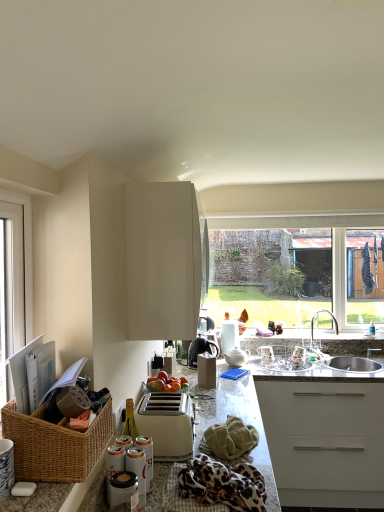
Measure the distance between green textured towel at lower center and camera.

A distance of 1.64 meters exists between green textured towel at lower center and camera.

Measure the distance between point (202, 350) and camera.

They are 9.43 feet apart.

Describe the element at coordinates (200, 350) in the screenshot. I see `matte black coffee maker at center, which is counted as the 2th appliance, starting from the front` at that location.

Measure the distance between point (232, 355) and camera.

Point (232, 355) and camera are 10.28 feet apart.

What is the approximate width of leopard print fabric at lower center?

14.46 inches.

I want to click on woven brown basket at lower left, so click(x=54, y=445).

Is glossy white cabinet at upper center in front of or behind satin nickel faucet at sink right in the image?

Visually, glossy white cabinet at upper center is located in front of satin nickel faucet at sink right.

From a real-world perspective, is glossy white cabinet at upper center on satin nickel faucet at sink right?

Yes, from a real-world perspective, glossy white cabinet at upper center is over satin nickel faucet at sink right

How different are the orientations of glossy white cabinet at upper center and satin nickel faucet at sink right in degrees?

90 degrees separate the facing orientations of glossy white cabinet at upper center and satin nickel faucet at sink right.

From the image's perspective, is glossy white cabinet at upper center on top of satin nickel faucet at sink right?

Yes, from the image's perspective, glossy white cabinet at upper center is on top of satin nickel faucet at sink right.

Is granite countertop at center aimed at white plastic window at left?

No, granite countertop at center is not facing towards white plastic window at left.

From the image's perspective, does granite countertop at center appear lower than white plastic window at left?

Correct, granite countertop at center appears lower than white plastic window at left in the image.

Can you confirm if granite countertop at center is positioned to the right of white plastic window at left?

Yes.

Are granite countertop at center and white plastic window at left far apart?

Yes.

Considering the sizes of green textured towel at lower center and satin nickel faucet at sink right in the image, is green textured towel at lower center wider or thinner than satin nickel faucet at sink right?

Clearly, green textured towel at lower center has less width compared to satin nickel faucet at sink right.

In the image, is green textured towel at lower center on the left side or the right side of satin nickel faucet at sink right?

Based on their positions, green textured towel at lower center is located to the left of satin nickel faucet at sink right.

Locate an element on the screen. material in front of the satin nickel faucet at sink right is located at coordinates (231, 438).

Which is correct: white plastic window at left is inside metallic silver can at lower center, the 1th appliance when ordered from front to back, or outside of it?

white plastic window at left exists outside the volume of metallic silver can at lower center, the 1th appliance when ordered from front to back.

Measure the distance between white plastic window at left and metallic silver can at lower center, marked as the 3th appliance in a right-to-left arrangement.

white plastic window at left and metallic silver can at lower center, marked as the 3th appliance in a right-to-left arrangement, are 68.38 centimeters apart.

Is white plastic window at left far away from metallic silver can at lower center, the 1th appliance when ordered from front to back?

Actually, white plastic window at left and metallic silver can at lower center, the 1th appliance when ordered from front to back, are a little close together.

The image size is (384, 512). I want to click on the 1st appliance behind the white plastic window at left, counting from the anchor's position, so click(138, 470).

Is point (27, 236) closer or farther from the camera than point (311, 339)?

Point (27, 236) appears to be closer to the viewer than point (311, 339).

Measure the distance between white plastic window at left and satin nickel faucet at sink right.

The distance of white plastic window at left from satin nickel faucet at sink right is 2.65 meters.

Is white plastic window at left in front of or behind satin nickel faucet at sink right in the image?

In the image, white plastic window at left appears in front of satin nickel faucet at sink right.

From the image's perspective, who appears lower, white plastic window at left or satin nickel faucet at sink right?

satin nickel faucet at sink right.

Is glossy white cabinet at upper center at the back of granite countertop at center?

No, granite countertop at center is not facing the opposite direction of glossy white cabinet at upper center.

In the scene shown: From the image's perspective, which is below, granite countertop at center or glossy white cabinet at upper center?

granite countertop at center.

Based on the photo, who is shorter, granite countertop at center or glossy white cabinet at upper center?

With less height is glossy white cabinet at upper center.

Is point (40, 457) behind point (242, 362)?

That is False.

Can you confirm if woven brown basket at lower left is wider than white ceramic teapot at center, the first appliance when ordered from right to left?

Yes.

Is woven brown basket at lower left to the left or to the right of white ceramic teapot at center, the first appliance when ordered from right to left, in the image?

woven brown basket at lower left is to the left of white ceramic teapot at center, the first appliance when ordered from right to left.

Is woven brown basket at lower left oriented towards white ceramic teapot at center, the first appliance when ordered from right to left?

No, woven brown basket at lower left is not oriented towards white ceramic teapot at center, the first appliance when ordered from right to left.

You are a GUI agent. You are given a task and a screenshot of the screen. Output one action in this format:
    pyautogui.click(x=<x>, y=<y>)
    Task: Click on the tap below the glossy white cabinet at upper center (from the image's perspective)
    
    Given the screenshot: What is the action you would take?
    pyautogui.click(x=315, y=318)

Locate an element on the screen. This screenshot has height=512, width=384. countertop located underneath the white plastic window at left (from a real-world perspective) is located at coordinates (311, 432).

Which object lies nearer to the anchor point matte black coffee maker at center, which is the 2th appliance in right-to-left order, granite countertop at center or woven brown basket at lower left?

The object closer to matte black coffee maker at center, which is the 2th appliance in right-to-left order, is granite countertop at center.

When comparing their distances from white plastic window at left, does metallic silver can at lower center, marked as the 3th appliance in a right-to-left arrangement, or leopard print fabric at lower center seem further?

leopard print fabric at lower center is positioned further to the anchor white plastic window at left.

When comparing their distances from satin nickel faucet at sink right, does granite countertop at center or white ceramic teapot at center, the first appliance when ordered from right to left, seem closer?

white ceramic teapot at center, the first appliance when ordered from right to left, lies closer to satin nickel faucet at sink right than the other object.

Considering their positions, is green textured towel at lower center positioned closer to satin nickel faucet at sink right than white plastic toaster at center?

green textured towel at lower center lies closer to satin nickel faucet at sink right than the other object.

When comparing their distances from metallic silver can at lower center, positioned as the first appliance in left-to-right order, does glossy white cabinet at upper center or matte black coffee maker at center, placed as the second appliance when sorted from back to front, seem further?

matte black coffee maker at center, placed as the second appliance when sorted from back to front, lies further to metallic silver can at lower center, positioned as the first appliance in left-to-right order, than the other object.

Estimate the real-world distances between objects in this image. Which object is further from leopard print fabric at lower center, white plastic window at left or glossy white cabinet at upper center?

white plastic window at left lies further to leopard print fabric at lower center than the other object.

When comparing their distances from leopard print fabric at lower center, does white plastic toaster at center or glossy white cabinet at upper center seem closer?

Among the two, white plastic toaster at center is located nearer to leopard print fabric at lower center.

Based on their spatial positions, is matte black coffee maker at center, placed as the second appliance when sorted from back to front, or woven brown basket at lower left closer to metallic silver can at lower center, the 1th appliance when ordered from front to back?

Based on the image, woven brown basket at lower left appears to be nearer to metallic silver can at lower center, the 1th appliance when ordered from front to back.

The image size is (384, 512). I want to click on blanket between woven brown basket at lower left and white plastic toaster at center along the z-axis, so click(223, 484).

This screenshot has width=384, height=512. What are the coordinates of `cabinetry positioned between white plastic window at left and white ceramic teapot at center, acting as the first appliance starting from the back, from near to far` in the screenshot? It's located at (164, 260).

In order to click on toaster between glossy white cabinet at upper center and green textured towel at lower center from top to bottom in this screenshot , I will do `click(167, 424)`.

Where is `toaster between granite countertop at center and white ceramic teapot at center, acting as the first appliance starting from the back, along the z-axis`? The width and height of the screenshot is (384, 512). toaster between granite countertop at center and white ceramic teapot at center, acting as the first appliance starting from the back, along the z-axis is located at coordinates (167, 424).